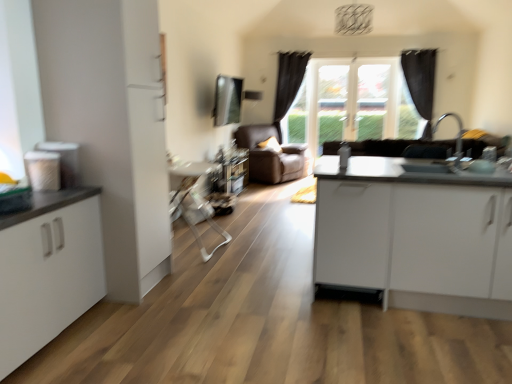
Question: Considering the relative sizes of black fabric curtain at upper right, which appears as the 2th curtain when viewed from the left, and black fabric curtain at center, the second curtain when ordered from right to left, in the image provided, is black fabric curtain at upper right, which appears as the 2th curtain when viewed from the left, smaller than black fabric curtain at center, the second curtain when ordered from right to left,?

Choices:
 (A) yes
 (B) no

Answer: (A)

Question: Is black fabric curtain at upper right, which appears as the 1th curtain when viewed from the right, next to black fabric curtain at center, the second curtain when ordered from right to left?

Choices:
 (A) no
 (B) yes

Answer: (A)

Question: Does black fabric curtain at upper right, which appears as the 1th curtain when viewed from the right, have a larger size compared to black fabric curtain at center, the second curtain when ordered from right to left?

Choices:
 (A) no
 (B) yes

Answer: (A)

Question: Is black fabric curtain at upper right, which appears as the 1th curtain when viewed from the right, positioned beyond the bounds of black fabric curtain at center, the second curtain when ordered from right to left?

Choices:
 (A) yes
 (B) no

Answer: (A)

Question: Is black fabric curtain at upper right, which appears as the 2th curtain when viewed from the left, closer to camera compared to black fabric curtain at center, the second curtain when ordered from right to left?

Choices:
 (A) yes
 (B) no

Answer: (A)

Question: Relative to matte brown leather couch at center, is transparent glass window at center in front or behind?

Choices:
 (A) front
 (B) behind

Answer: (B)

Question: Visually, is transparent glass window at center positioned to the left or to the right of matte brown leather couch at center?

Choices:
 (A) left
 (B) right

Answer: (B)

Question: Would you say transparent glass window at center is inside or outside matte brown leather couch at center?

Choices:
 (A) inside
 (B) outside

Answer: (B)

Question: From their relative heights in the image, would you say transparent glass window at center is taller or shorter than matte brown leather couch at center?

Choices:
 (A) tall
 (B) short

Answer: (A)

Question: Considering the relative positions of white matte cabinet at left and black fabric curtain at center, the second curtain when ordered from right to left, in the image provided, is white matte cabinet at left to the left or to the right of black fabric curtain at center, the second curtain when ordered from right to left,?

Choices:
 (A) left
 (B) right

Answer: (A)

Question: From a real-world perspective, relative to black fabric curtain at center, which is counted as the 1th curtain, starting from the left, is white matte cabinet at left vertically above or below?

Choices:
 (A) below
 (B) above

Answer: (A)

Question: Is white matte cabinet at left spatially inside black fabric curtain at center, the second curtain when ordered from right to left, or outside of it?

Choices:
 (A) inside
 (B) outside

Answer: (B)

Question: In terms of height, does white matte cabinet at left look taller or shorter compared to black fabric curtain at center, which is counted as the 1th curtain, starting from the left?

Choices:
 (A) short
 (B) tall

Answer: (A)

Question: Is point (16, 233) closer or farther from the camera than point (397, 193)?

Choices:
 (A) farther
 (B) closer

Answer: (B)

Question: Is white matte cabinet at left to the left or to the right of white glossy cabinet at right, acting as the second table starting from the left, in the image?

Choices:
 (A) right
 (B) left

Answer: (B)